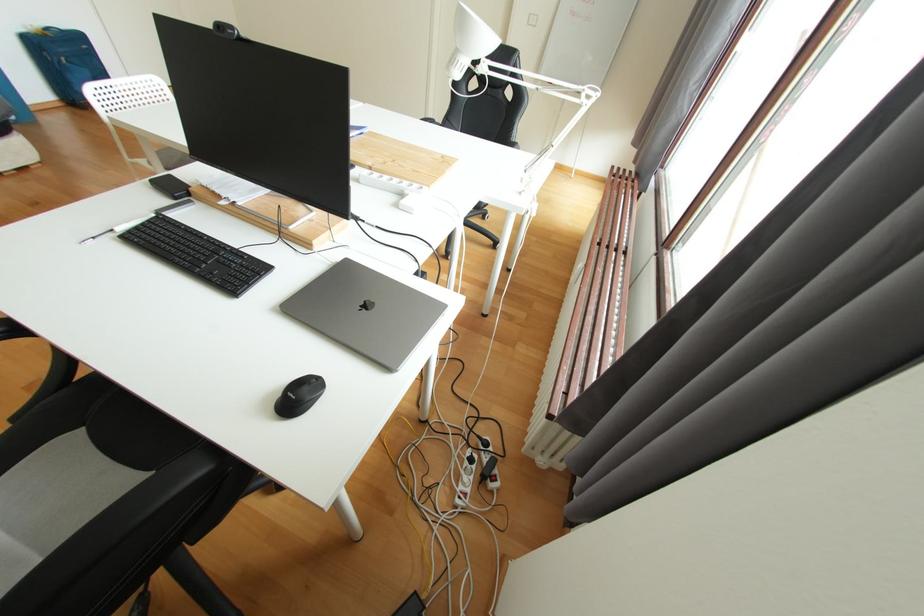
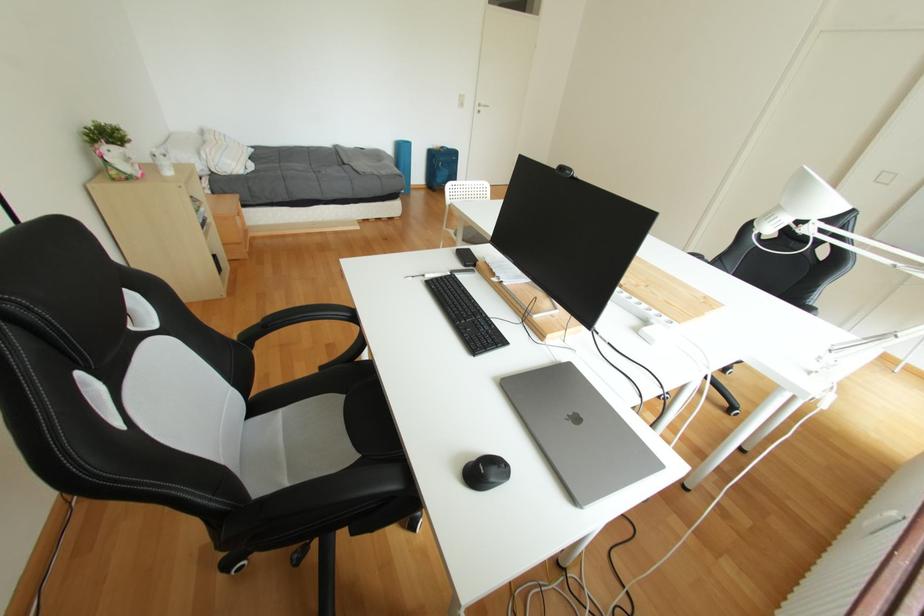
Question: The images are taken continuously from a first-person perspective. In which direction is your viewpoint rotating?

Choices:
 (A) Left
 (B) Right
 (C) Up
 (D) Down

Answer: (A)